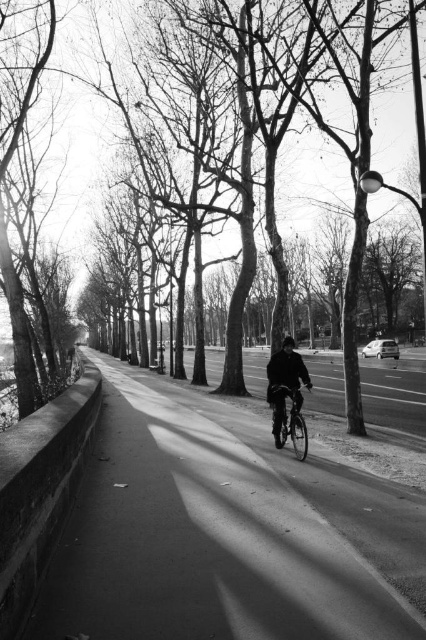
Does smooth bark tree at center have a lesser width compared to dark matte jacket at center?

No, smooth bark tree at center is not thinner than dark matte jacket at center.

Is point (229, 230) positioned behind point (296, 401)?

Yes, it is.

Does point (382, 157) come behind point (278, 412)?

Yes, point (382, 157) is behind point (278, 412).

This screenshot has width=426, height=640. In order to click on smooth bark tree at center in this screenshot , I will do `click(77, 170)`.

Is point (198, 636) farther from camera compared to point (396, 376)?

No.

In the scene shown: Which is more to the right, asphalt bike path at center or dark matte bicycle at center?

From the viewer's perspective, dark matte bicycle at center appears more on the right side.

I want to click on asphalt bike path at center, so click(213, 532).

In order to click on dark matte bicycle at center in this screenshot , I will do `click(391, 387)`.

Does dark matte bicycle at center have a smaller size compared to dark matte jacket at center?

Incorrect, dark matte bicycle at center is not smaller in size than dark matte jacket at center.

Between point (377, 388) and point (279, 385), which one is positioned in front?

Point (279, 385) is more forward.

The width and height of the screenshot is (426, 640). What are the coordinates of `dark matte bicycle at center` in the screenshot? It's located at (391, 387).